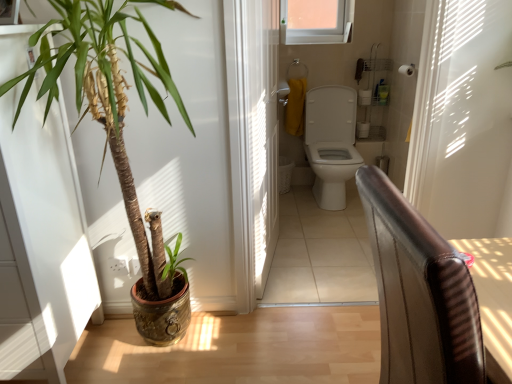
You are a GUI agent. You are given a task and a screenshot of the screen. Output one action in this format:
    pyautogui.click(x=<x>, y=<y>)
    Task: Click on the unoccupied region to the right of green leafy plant at left
    The height and width of the screenshot is (384, 512).
    Given the screenshot: What is the action you would take?
    pyautogui.click(x=256, y=342)